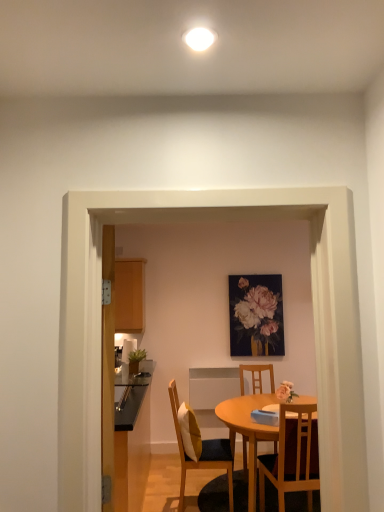
Measure the distance between point (x=288, y=471) and camera.

The distance of point (x=288, y=471) from camera is 3.01 meters.

Find the location of a particular element. wooden cushioned chair at center, the 1th chair from the left is located at coordinates click(x=203, y=452).

This screenshot has width=384, height=512. Describe the element at coordinates (203, 452) in the screenshot. I see `wooden cushioned chair at center, the third chair in the right-to-left sequence` at that location.

What do you see at coordinates (256, 315) in the screenshot? This screenshot has height=512, width=384. I see `matte black picture frame at center` at bounding box center [256, 315].

At what (x,y) coordinates should I click in order to perform the action: click on wooden table at center. Please return your answer as a coordinate pair (x, y). Looking at the image, I should click on (229, 439).

Locate an element on the screen. This screenshot has height=512, width=384. wooden chair at lower right, the third chair when ordered from left to right is located at coordinates coord(292,455).

Is the position of glossy black countertop at left less distant than that of wooden chair at center, positioned as the 2th chair in left-to-right order?

Yes, it is.

Between glossy black countertop at left and wooden chair at center, positioned as the 2th chair in left-to-right order, which one has smaller width?

Thinner between the two is glossy black countertop at left.

Who is shorter, glossy black countertop at left or wooden chair at center, which is counted as the third chair, starting from the front?

Standing shorter between the two is glossy black countertop at left.

From a real-world perspective, starting from the glossy black countertop at left, which chair is the 3rd one below it? Please provide its 2D coordinates.

[(254, 376)]

Between transparent glass door at center and wooden chair at center, which ranks as the 2th chair in right-to-left order, which one has smaller size?

Smaller between the two is wooden chair at center, which ranks as the 2th chair in right-to-left order.

Is there a large distance between transparent glass door at center and wooden chair at center, which ranks as the 2th chair in right-to-left order?

That's right, there is a large distance between transparent glass door at center and wooden chair at center, which ranks as the 2th chair in right-to-left order.

What's the angular difference between transparent glass door at center and wooden chair at center, which is counted as the third chair, starting from the front,'s facing directions?

They differ by 178 degrees in their facing directions.

From the image's perspective, is transparent glass door at center above or below wooden chair at center, which is the 1th chair in back-to-front order?

Based on their image positions, transparent glass door at center is located above wooden chair at center, which is the 1th chair in back-to-front order.

From the image's perspective, which object appears higher, wooden cushioned chair at center, the third chair in the right-to-left sequence, or matte black picture frame at center?

matte black picture frame at center.

Is point (221, 449) more distant than point (271, 284)?

No, it is in front of (271, 284).

Where is `picture frame above the wooden cushioned chair at center, positioned as the 2th chair in front-to-back order (from a real-world perspective)`? picture frame above the wooden cushioned chair at center, positioned as the 2th chair in front-to-back order (from a real-world perspective) is located at coordinates (256, 315).

Could you tell me if wooden cushioned chair at center, the 1th chair from the left, is turned towards matte black picture frame at center?

No, wooden cushioned chair at center, the 1th chair from the left, is not oriented towards matte black picture frame at center.

Is wooden cabinet at left not within wooden chair at lower right, which appears as the 1th chair when viewed from the front?

Absolutely, wooden cabinet at left is external to wooden chair at lower right, which appears as the 1th chair when viewed from the front.

At what (x,y) coordinates should I click in order to perform the action: click on the 3rd chair in front of the wooden cabinet at left, starting your count from the anchor. Please return your answer as a coordinate pair (x, y). This screenshot has height=512, width=384. Looking at the image, I should click on (292, 455).

From a real-world perspective, who is located higher, wooden cabinet at left or wooden chair at lower right, arranged as the 3th chair when viewed from the back?

In real-world perspective, wooden cabinet at left is above.

Is point (121, 280) positioned after point (271, 456)?

Yes, point (121, 280) is behind point (271, 456).

Starting from the glossy black countertop at left, which chair is the 1st one to the right? Please provide its 2D coordinates.

[(203, 452)]

Does wooden cushioned chair at center, the 2th chair when ordered from back to front, have a larger size compared to glossy black countertop at left?

Yes, wooden cushioned chair at center, the 2th chair when ordered from back to front, is bigger than glossy black countertop at left.

Is wooden cushioned chair at center, the third chair in the right-to-left sequence, wider than glossy black countertop at left?

Yes.

Is wooden cushioned chair at center, the third chair in the right-to-left sequence, shorter than glossy black countertop at left?

No.

From a real-world perspective, is wooden cabinet at left beneath transparent glass door at center?

No.

Is wooden cabinet at left next to transparent glass door at center?

No, wooden cabinet at left is not with transparent glass door at center.

Does point (126, 273) lie in front of point (343, 364)?

No, it is not.

Is wooden cabinet at left looking in the opposite direction of transparent glass door at center?

That's not correct — wooden cabinet at left is not looking away from transparent glass door at center.

From the image's perspective, count 3rd chairs downward from the glossy black countertop at left and point to it. Please provide its 2D coordinates.

[(254, 376)]

Which object is closer to the camera taking this photo, wooden chair at center, which is counted as the third chair, starting from the front, or glossy black countertop at left?

glossy black countertop at left.

From the image's perspective, is wooden chair at center, which is counted as the third chair, starting from the front, on glossy black countertop at left?

No, from the image's perspective, wooden chair at center, which is counted as the third chair, starting from the front, is not on top of glossy black countertop at left.

How distant is wooden chair at center, which is counted as the third chair, starting from the front, from glossy black countertop at left?

The distance of wooden chair at center, which is counted as the third chair, starting from the front, from glossy black countertop at left is 5.25 feet.

Identify the location of counter top above the wooden chair at center, which is the 1th chair in back-to-front order (from a real-world perspective). The image size is (384, 512). (131, 394).

At what (x,y) coordinates should I click in order to perform the action: click on glass door in front of the wooden chair at center, which is the 1th chair in back-to-front order. Please return your answer as a coordinate pair (x, y). Looking at the image, I should click on (313, 317).

Looking at the image, which one is located closer to wooden cabinet at left, wooden chair at center, which is counted as the third chair, starting from the front, or wooden cushioned chair at center, the 2th chair when ordered from back to front?

The object closer to wooden cabinet at left is wooden cushioned chair at center, the 2th chair when ordered from back to front.

Considering their positions, is wooden cushioned chair at center, the 2th chair when ordered from back to front, positioned further to matte black picture frame at center than wooden chair at center, which is counted as the third chair, starting from the front?

wooden cushioned chair at center, the 2th chair when ordered from back to front.

From the picture: Based on their spatial positions, is wooden table at center or wooden cabinet at left closer to wooden chair at lower right, the third chair when ordered from left to right?

wooden table at center.

Estimate the real-world distances between objects in this image. Which object is closer to glossy black countertop at left, wooden cushioned chair at center, the 2th chair when ordered from back to front, or wooden cabinet at left?

wooden cushioned chair at center, the 2th chair when ordered from back to front, is positioned closer to the anchor glossy black countertop at left.

Looking at the image, which one is located closer to wooden chair at center, which ranks as the 2th chair in right-to-left order, wooden table at center or glossy black countertop at left?

wooden table at center is positioned closer to the anchor wooden chair at center, which ranks as the 2th chair in right-to-left order.

Which object lies nearer to the anchor point matte black picture frame at center, wooden chair at center, which is counted as the third chair, starting from the front, or wooden cabinet at left?

wooden chair at center, which is counted as the third chair, starting from the front, is positioned closer to the anchor matte black picture frame at center.

Estimate the real-world distances between objects in this image. Which object is closer to wooden cushioned chair at center, the 2th chair when ordered from back to front, glossy black countertop at left or transparent glass door at center?

glossy black countertop at left lies closer to wooden cushioned chair at center, the 2th chair when ordered from back to front, than the other object.

When comparing their distances from wooden chair at lower right, which appears as the 1th chair when viewed from the front, does wooden table at center or wooden cushioned chair at center, the third chair in the right-to-left sequence, seem closer?

wooden table at center is closer to wooden chair at lower right, which appears as the 1th chair when viewed from the front.

Identify the location of cabinetry positioned between glossy black countertop at left and matte black picture frame at center from near to far. This screenshot has height=512, width=384. (130, 295).

Identify the location of counter top between wooden chair at lower right, which appears as the 1th chair when viewed from the front, and matte black picture frame at center, along the z-axis. The image size is (384, 512). (131, 394).

This screenshot has height=512, width=384. What are the coordinates of `counter top located between wooden table at center and matte black picture frame at center in the depth direction` in the screenshot? It's located at (131, 394).

Identify the location of counter top between transparent glass door at center and matte black picture frame at center in the front-back direction. (131, 394).